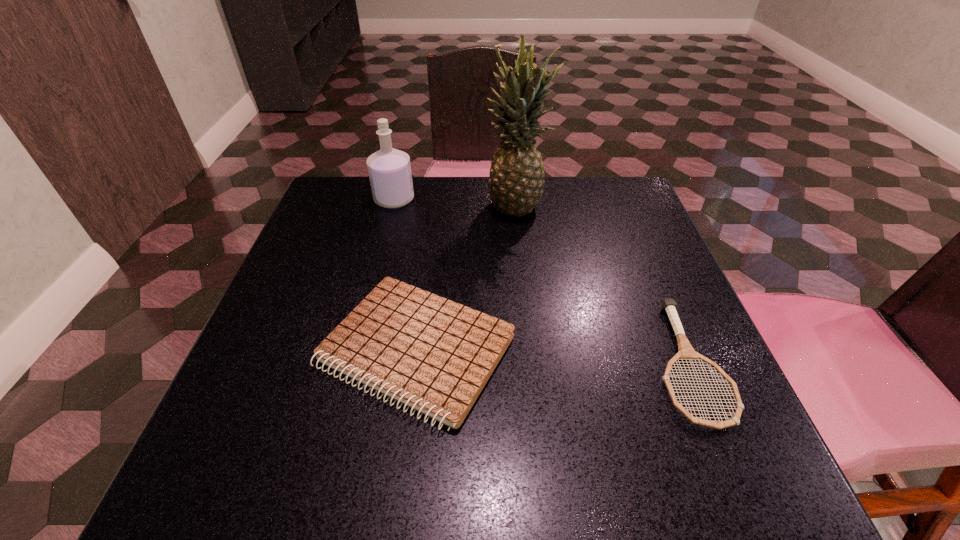
Where is `vacant position at the far right corner of the desktop`? vacant position at the far right corner of the desktop is located at coordinates (583, 217).

I want to click on free space between the tallest object and the tennis racket, so click(602, 284).

You are a GUI agent. You are given a task and a screenshot of the screen. Output one action in this format:
    pyautogui.click(x=<x>, y=<y>)
    Task: Click on the vacant area between the third shortest object and the pineapple
    This screenshot has height=540, width=960.
    Given the screenshot: What is the action you would take?
    pyautogui.click(x=456, y=202)

Locate an element on the screen. This screenshot has height=540, width=960. vacant point located between the tallest object and the tennis racket is located at coordinates (602, 284).

This screenshot has width=960, height=540. I want to click on vacant area that lies between the tallest object and the perfume, so click(456, 202).

This screenshot has width=960, height=540. In order to click on free point between the perfume and the notebook in this screenshot , I will do `click(405, 274)`.

The image size is (960, 540). In order to click on vacant space in between the third shortest object and the tallest object in this screenshot , I will do `click(456, 202)`.

Locate an element on the screen. This screenshot has width=960, height=540. blank region between the tennis racket and the perfume is located at coordinates (540, 281).

Where is `free space between the notebook and the tennis racket`? The width and height of the screenshot is (960, 540). free space between the notebook and the tennis racket is located at coordinates (551, 356).

Where is `free space between the pineapple and the perfume`? free space between the pineapple and the perfume is located at coordinates (456, 202).